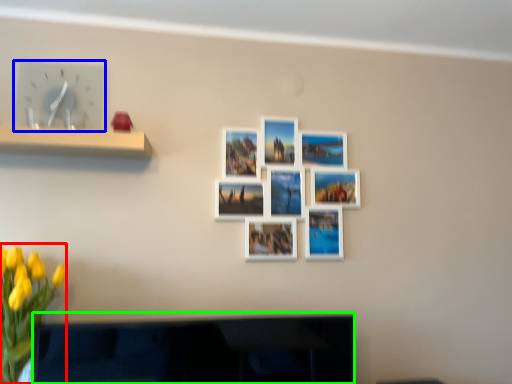
Question: Estimate the real-world distances between objects in this image. Which object is closer to floral arrangement (highlighted by a red box), clock (highlighted by a blue box) or television (highlighted by a green box)?

Choices:
 (A) clock
 (B) television

Answer: (B)